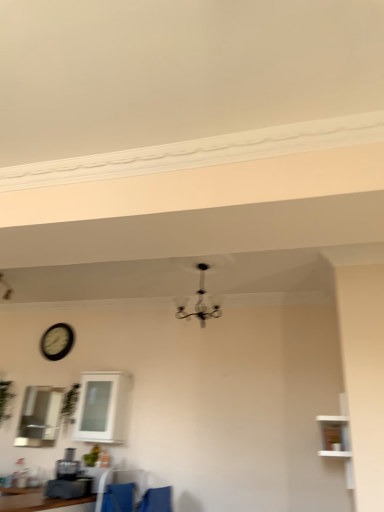
Question: Does blue fabric armchair at lower center appear on the left side of blue fabric feeding chair at lower center?

Choices:
 (A) no
 (B) yes

Answer: (A)

Question: Is blue fabric armchair at lower center positioned in front of blue fabric feeding chair at lower center?

Choices:
 (A) no
 (B) yes

Answer: (B)

Question: Is blue fabric armchair at lower center with blue fabric feeding chair at lower center?

Choices:
 (A) no
 (B) yes

Answer: (A)

Question: From a real-world perspective, does blue fabric armchair at lower center stand above blue fabric feeding chair at lower center?

Choices:
 (A) no
 (B) yes

Answer: (B)

Question: Is blue fabric armchair at lower center oriented towards blue fabric feeding chair at lower center?

Choices:
 (A) no
 (B) yes

Answer: (B)

Question: Does blue fabric armchair at lower center have a lesser height compared to blue fabric feeding chair at lower center?

Choices:
 (A) no
 (B) yes

Answer: (B)

Question: Is white wooden shelf at right oriented towards green leafy plant at center, positioned as the 1th plant in right-to-left order?

Choices:
 (A) yes
 (B) no

Answer: (A)

Question: Is the surface of white wooden shelf at right in direct contact with green leafy plant at center, positioned as the 1th plant in right-to-left order?

Choices:
 (A) yes
 (B) no

Answer: (B)

Question: Is white wooden shelf at right positioned with its back to green leafy plant at center, positioned as the 1th plant in right-to-left order?

Choices:
 (A) no
 (B) yes

Answer: (A)

Question: Does white wooden shelf at right have a lesser height compared to green leafy plant at center, which appears as the second plant when viewed from the left?

Choices:
 (A) yes
 (B) no

Answer: (B)

Question: From the image's perspective, would you say white wooden shelf at right is shown under green leafy plant at center, positioned as the 1th plant in right-to-left order?

Choices:
 (A) yes
 (B) no

Answer: (B)

Question: Is white wooden shelf at right positioned far away from green leafy plant at center, positioned as the 1th plant in right-to-left order?

Choices:
 (A) yes
 (B) no

Answer: (A)

Question: Can you confirm if blue fabric armchair at lower center is positioned to the left of white wooden shelf at right?

Choices:
 (A) yes
 (B) no

Answer: (A)